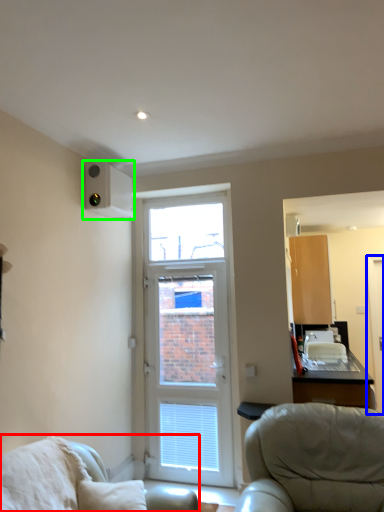
Question: Considering the real-world distances, which object is farthest from chair (highlighted by a red box)? screen door (highlighted by a blue box) or air conditioning (highlighted by a green box)?

Choices:
 (A) screen door
 (B) air conditioning

Answer: (A)